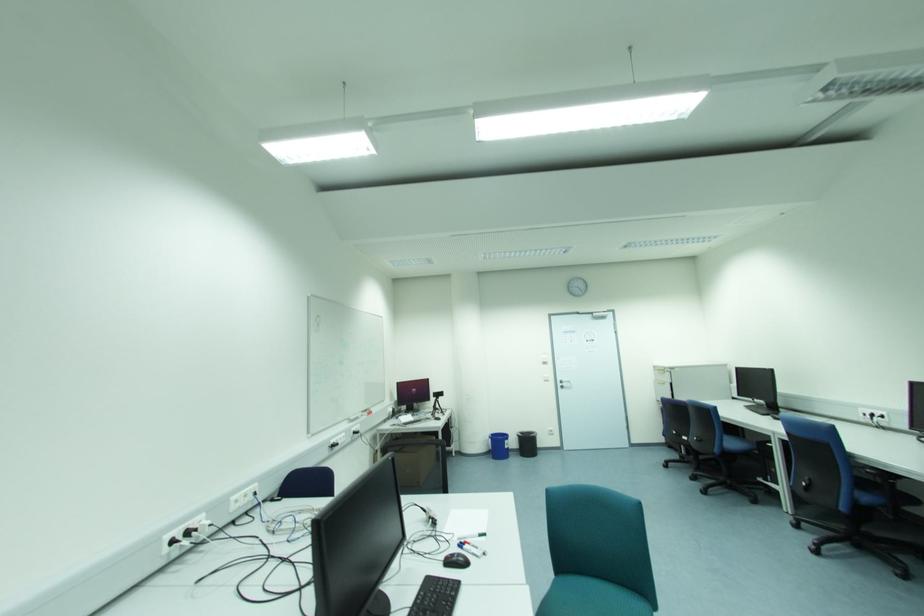
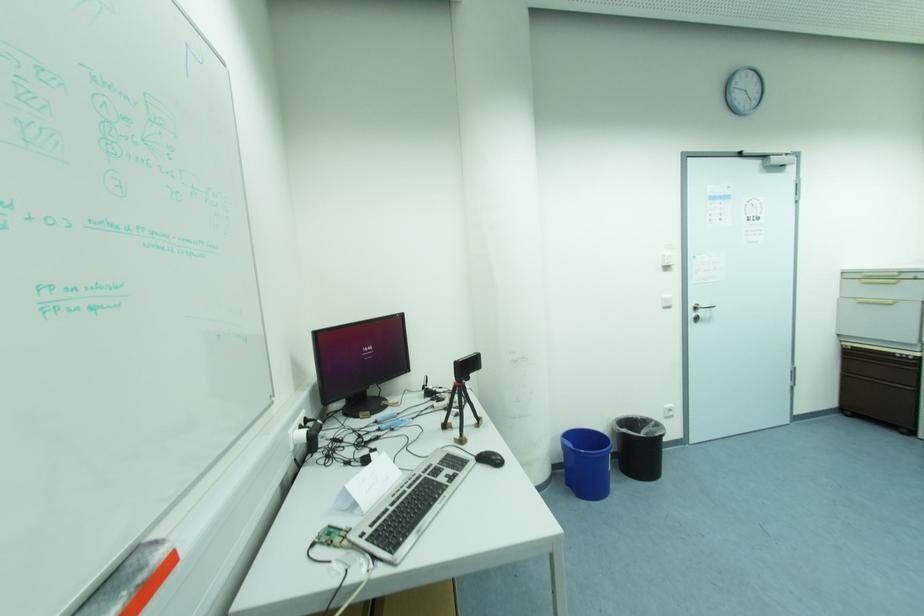
Where in the second image is the point corresponding to point (551, 430) from the first image?

(667, 406)